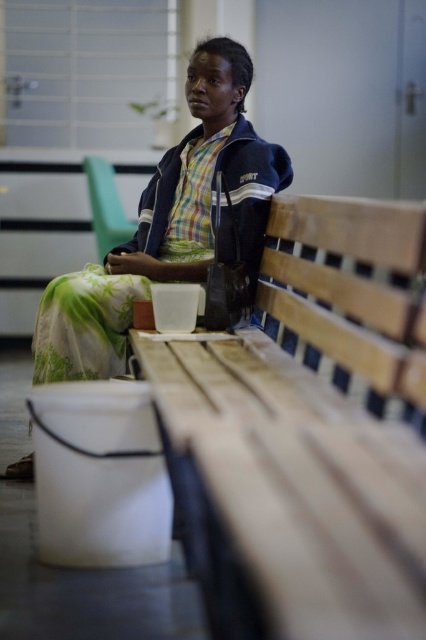
You are a person who needs to sit down. You see the wooden bench at center and the matte black jacket at center. Which object is lower to the ground and suitable for sitting?

The wooden bench at center is shorter than the matte black jacket at center, so it is lower to the ground and suitable for sitting.

You are standing in a hospital waiting room and see the wooden bench at center. If you want to sit down, where should you walk to?

You should walk to the wooden bench at center located at the coordinates (307, 432).

From the picture: You are a person trying to sit on the wooden bench at center while wearing the matte black jacket at center. Will the bench be wide enough to accommodate both your jacket and yourself comfortably?

The wooden bench at center has a lesser width compared to matte black jacket at center, meaning the bench is narrower than the jacket. This suggests the bench might not be wide enough to comfortably fit both the person and their jacket.